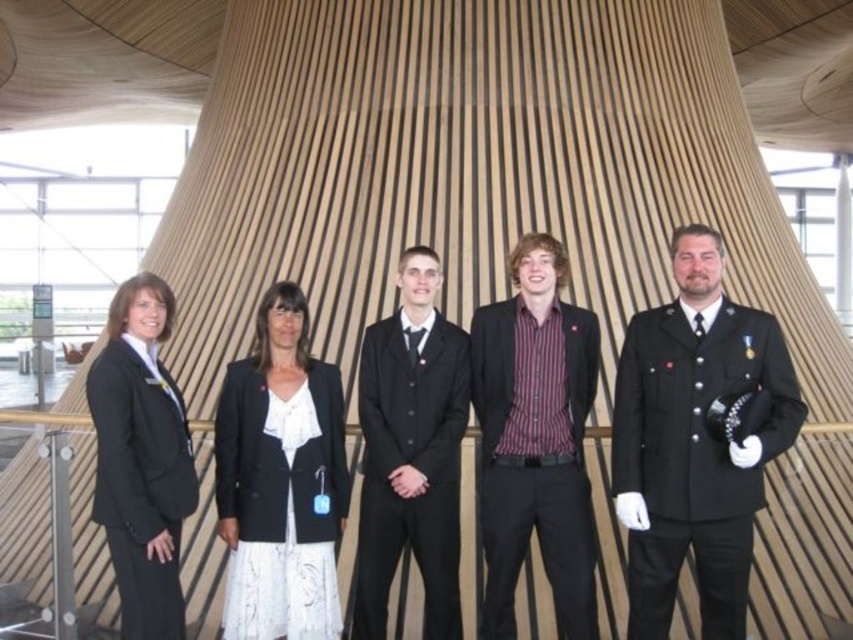
You are organizing a photo shoot and need to ensure that the striped cotton shirt at center and the black satin suit at center fit within a rectangular frame. Given that the frame can only accommodate the width of the narrower object, which clothing item should you adjust to ensure it fits?

The striped cotton shirt at center has a larger width than the black satin suit at center. To fit within the frame, you should adjust the striped cotton shirt at center to match the narrower width of the black satin suit at center.